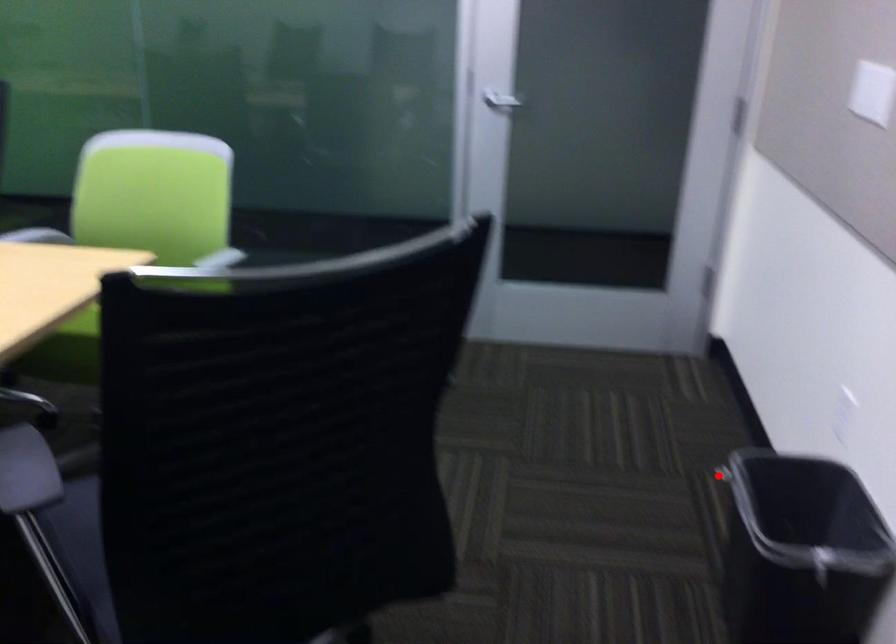
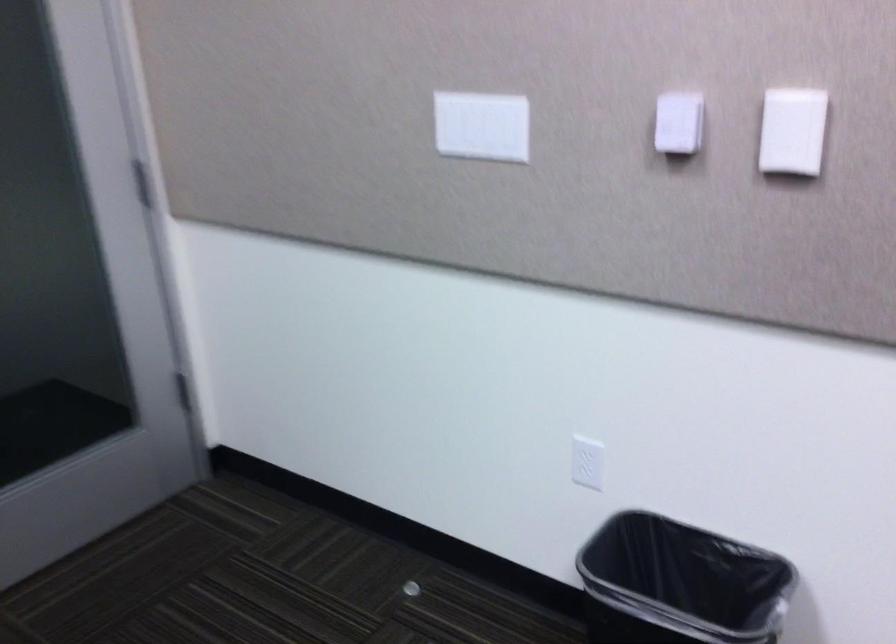
Question: A red point is marked in image1. In image2, is the corresponding 3D point closer to the camera or farther? Reply with the corresponding letter.

Choices:
 (A) The corresponding 3D point is closer.
 (B) The corresponding 3D point is farther.

Answer: (A)